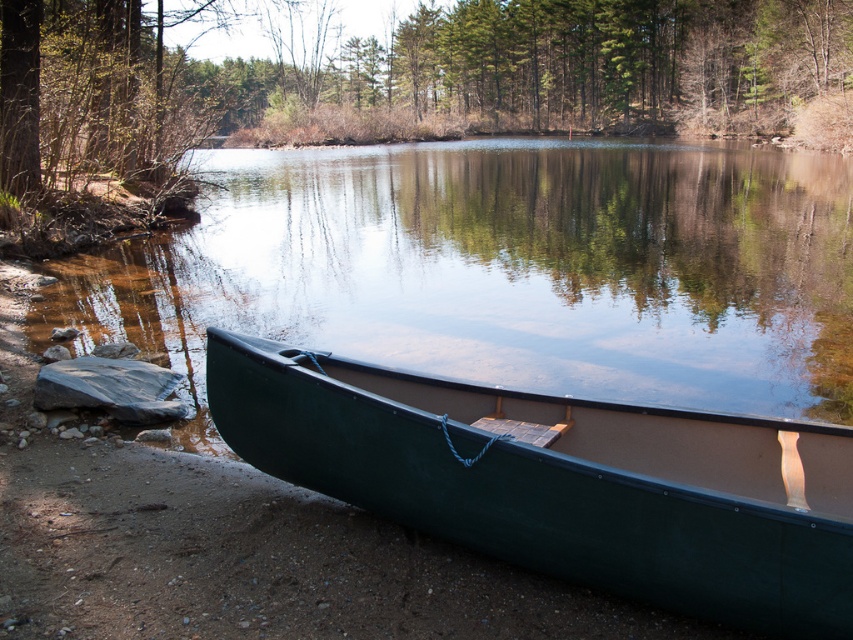
Does clear water at center have a lesser width compared to green plastic canoe at lower center?

No.

Between point (601, 390) and point (840, 620), which one is positioned in front?

Point (840, 620)

The width and height of the screenshot is (853, 640). In order to click on clear water at center in this screenshot , I will do click(503, 269).